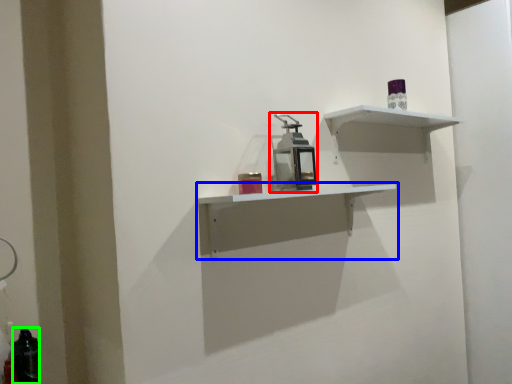
Question: Estimate the real-world distances between objects in this image. Which object is farther from medicine cabinet (highlighted by a red box), shelf (highlighted by a blue box) or bottle (highlighted by a green box)?

Choices:
 (A) shelf
 (B) bottle

Answer: (B)